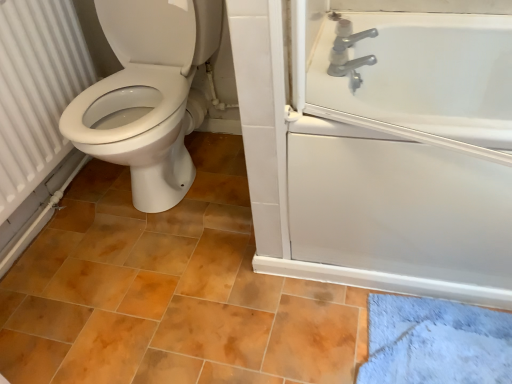
Question: In terms of height, does white glossy bathtub at upper right look taller or shorter compared to silver metallic faucet at upper right?

Choices:
 (A) short
 (B) tall

Answer: (B)

Question: Is white glossy bathtub at upper right to the left or to the right of silver metallic faucet at upper right in the image?

Choices:
 (A) left
 (B) right

Answer: (B)

Question: Which of these objects is positioned farthest from the silver metallic faucet at upper right?

Choices:
 (A) white glossy bathtub at upper right
 (B) white textured radiator at left

Answer: (B)

Question: Considering the real-world distances, which object is closest to the white textured radiator at left?

Choices:
 (A) white glossy bathtub at upper right
 (B) silver metallic faucet at upper right

Answer: (B)